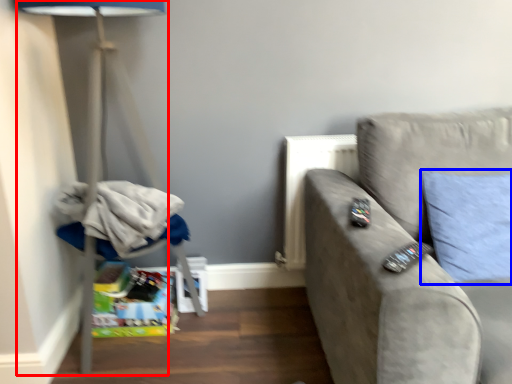
Question: Among these objects, which one is farthest to the camera, table lamp (highlighted by a red box) or pillow (highlighted by a blue box)?

Choices:
 (A) table lamp
 (B) pillow

Answer: (B)